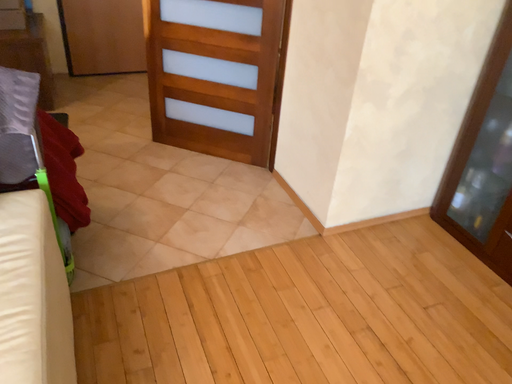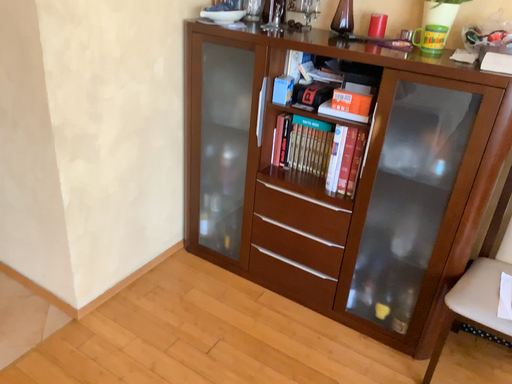
Question: How did the camera likely rotate when shooting the video?

Choices:
 (A) rotated right
 (B) rotated left

Answer: (A)